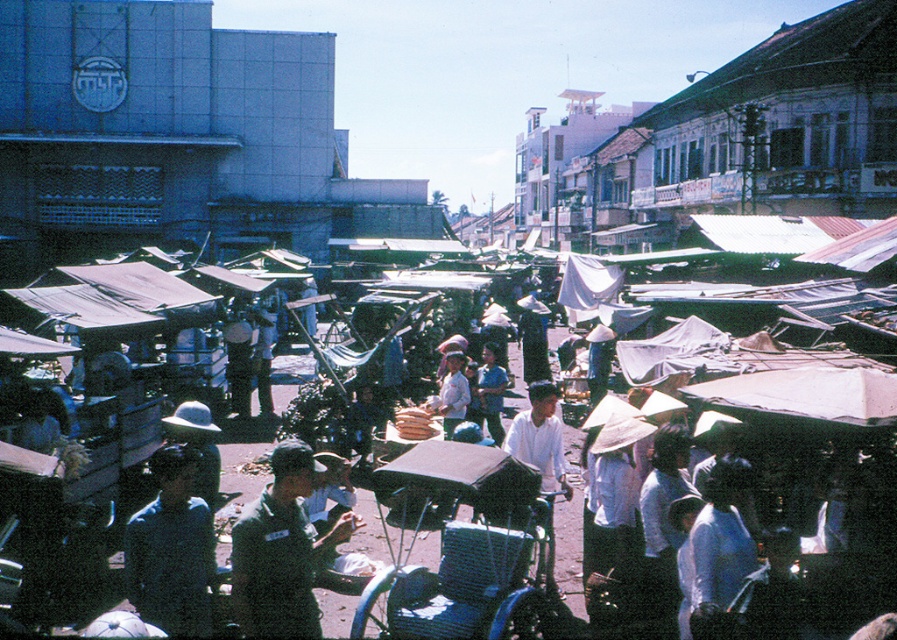
Question: Can you confirm if dark green uniform at center is positioned to the right of light blue shirt at center?

Choices:
 (A) yes
 (B) no

Answer: (B)

Question: Which of the following is the closest to the observer?

Choices:
 (A) dark green uniform at center
 (B) light blue shirt at center
 (C) white cotton shirt at center
 (D) white fabric market stalls at center

Answer: (A)

Question: Estimate the real-world distances between objects in this image. Which object is farther from the dark green uniform at center?

Choices:
 (A) light blue shirt at center
 (B) white cotton shirt at center
 (C) dark blue shirt at lower left
 (D) white fabric market stalls at center

Answer: (B)

Question: Which point is farther from the camera taking this photo?

Choices:
 (A) (475, 406)
 (B) (172, 579)
 (C) (449, 397)

Answer: (A)

Question: Can you confirm if dark green uniform at center is thinner than white cotton shirt at center?

Choices:
 (A) no
 (B) yes

Answer: (B)

Question: Can you confirm if white fabric market stalls at center is smaller than white cotton shirt at center?

Choices:
 (A) yes
 (B) no

Answer: (B)